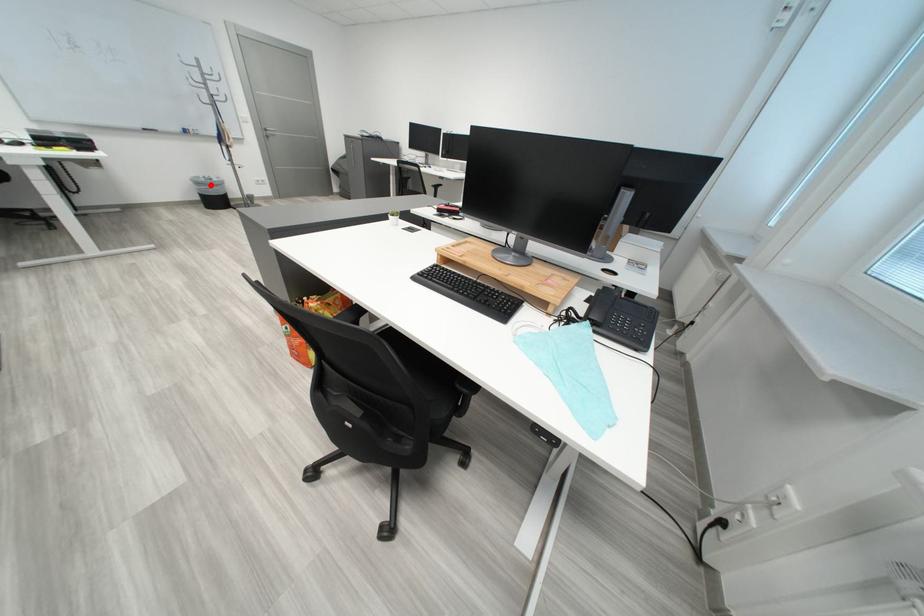
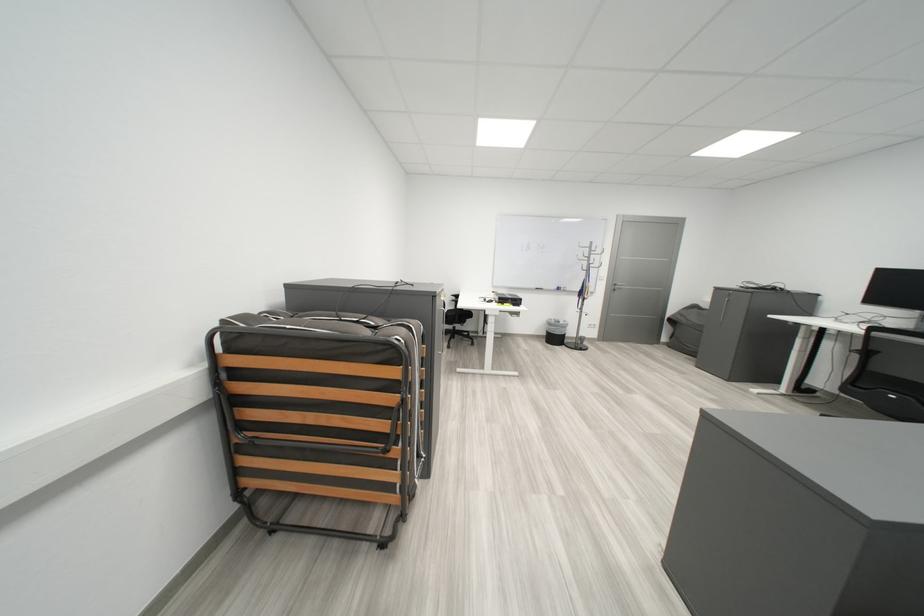
Question: I am providing you with two images of the same scene from different viewpoints. A red point is shown in image1. For the corresponding object point in image2, is it positioned nearer or farther from the camera?

Choices:
 (A) Nearer
 (B) Farther

Answer: (B)